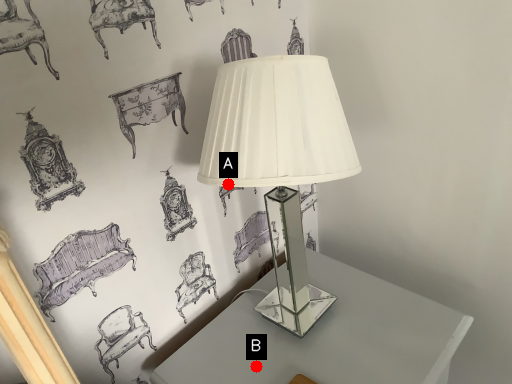
Question: Two points are circled on the image, labeled by A and B beside each circle. Which point is closer to the camera taking this photo?

Choices:
 (A) A is closer
 (B) B is closer

Answer: (A)